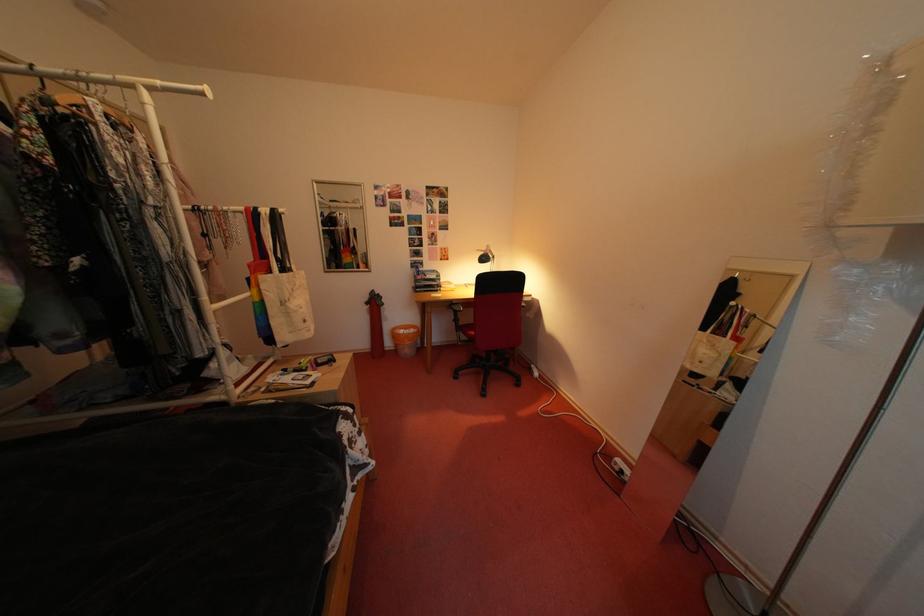
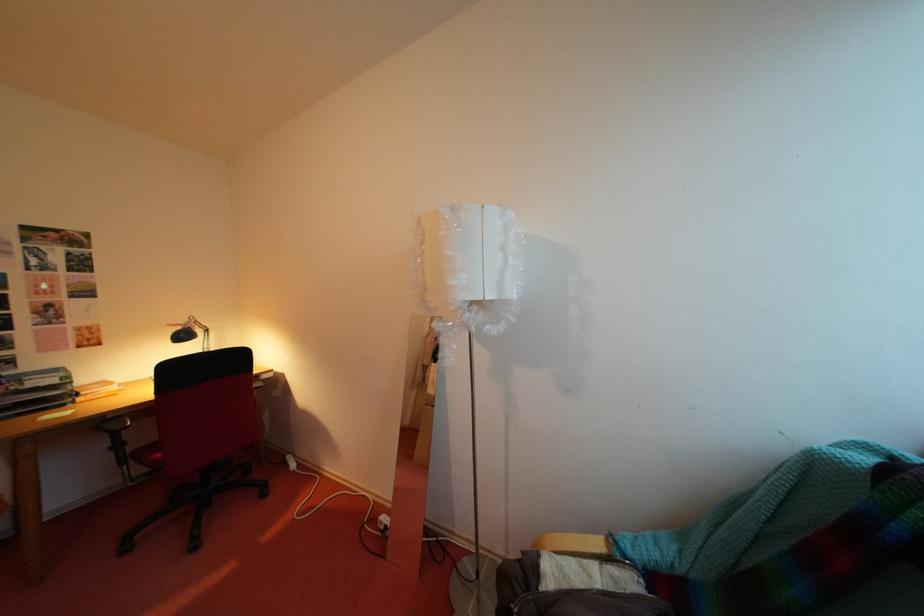
Question: The first image is from the beginning of the video and the second image is from the end. How did the camera likely rotate when shooting the video?

Choices:
 (A) Left
 (B) Right
 (C) Up
 (D) Down

Answer: (B)